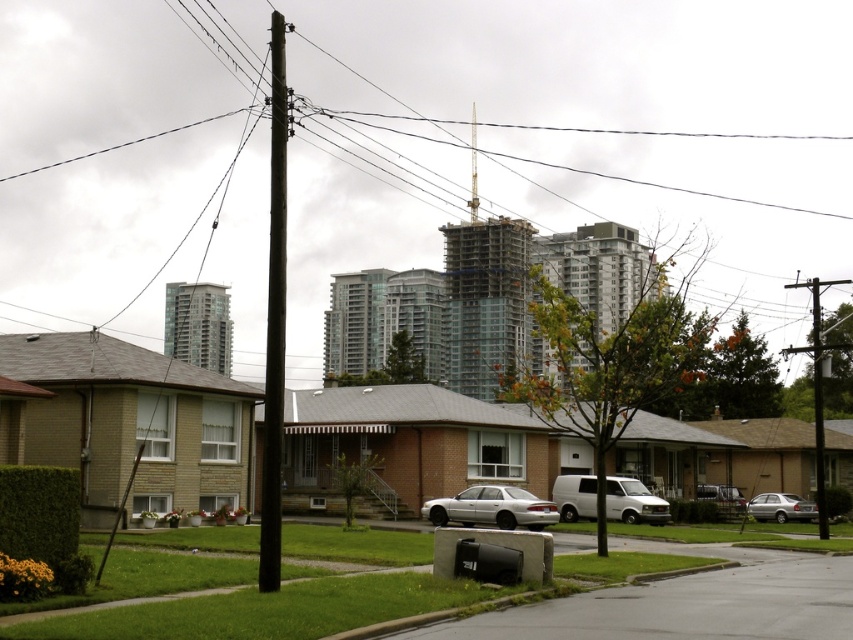
Question: Among these points, which one is farthest from the camera?

Choices:
 (A) (271, 248)
 (B) (757, 493)
 (C) (440, 499)

Answer: (B)

Question: Estimate the real-world distances between objects in this image. Which object is closer to the silver metallic sedan at lower right?

Choices:
 (A) brown wooden telegraph pole at center-left
 (B) white matte van at center

Answer: (B)

Question: Does silver metallic sedan at center come behind wooden telephone pole at right?

Choices:
 (A) no
 (B) yes

Answer: (B)

Question: Observing the image, what is the correct spatial positioning of silver metallic sedan at center in reference to wooden telephone pole at right?

Choices:
 (A) below
 (B) above

Answer: (A)

Question: Among these points, which one is nearest to the camera?

Choices:
 (A) (784, 518)
 (B) (740, 502)
 (C) (263, 580)
 (D) (817, 458)

Answer: (C)

Question: From the image, what is the correct spatial relationship of silver metallic sedan at lower right in relation to metallic silver sedan at center?

Choices:
 (A) above
 (B) below

Answer: (B)